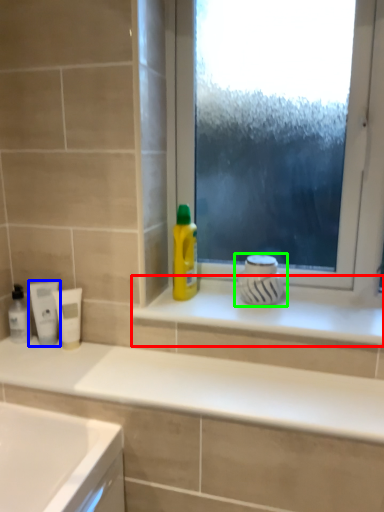
Question: Which is nearer to the window sill (highlighted by a red box)? mouthwash (highlighted by a blue box) or appliance (highlighted by a green box).

Choices:
 (A) mouthwash
 (B) appliance

Answer: (B)